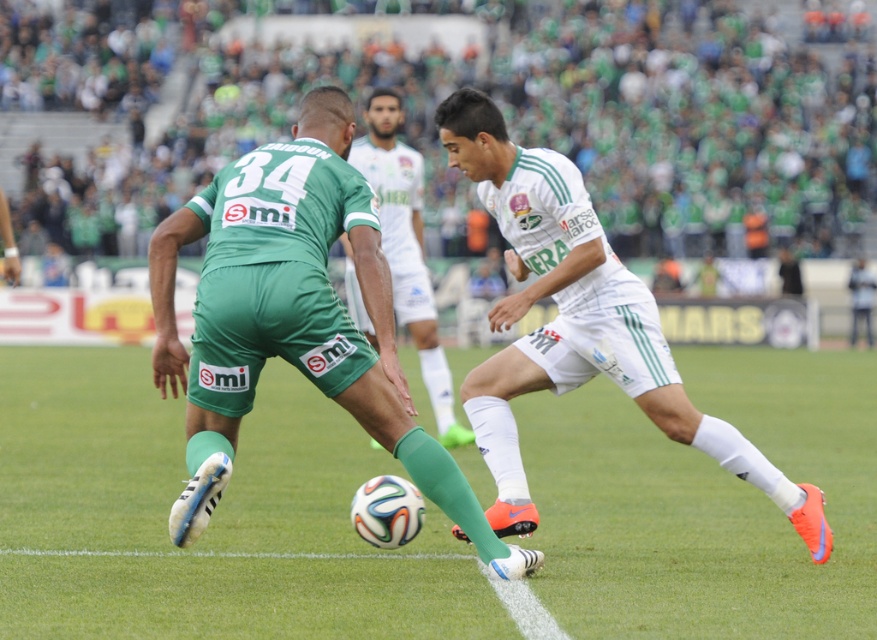
Question: Which of the following is the closest to the observer?

Choices:
 (A) (479, 419)
 (B) (368, 164)
 (C) (350, 397)
 (D) (590, 488)

Answer: (C)

Question: Is white matte shorts at center below green matte shorts at center?

Choices:
 (A) no
 (B) yes

Answer: (B)

Question: Which point is closer to the camera taking this photo?

Choices:
 (A) (355, 292)
 (B) (264, 323)
 (C) (568, 195)

Answer: (B)

Question: Considering the relative positions of white matte shorts at center and green matte shorts at center in the image provided, where is white matte shorts at center located with respect to green matte shorts at center?

Choices:
 (A) left
 (B) right

Answer: (B)

Question: Considering the relative positions of matte green jersey at center and green matte shorts at center in the image provided, where is matte green jersey at center located with respect to green matte shorts at center?

Choices:
 (A) left
 (B) right

Answer: (A)

Question: Which object is the closest to the green grass football field at center?

Choices:
 (A) white matte shorts at center
 (B) matte green jersey at center

Answer: (B)